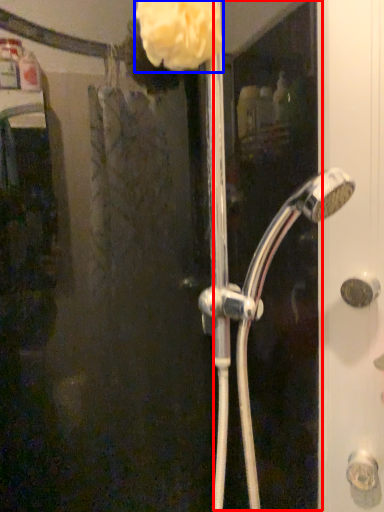
Question: Which object is further to the camera taking this photo, screen door (highlighted by a red box) or flower (highlighted by a blue box)?

Choices:
 (A) screen door
 (B) flower

Answer: (B)